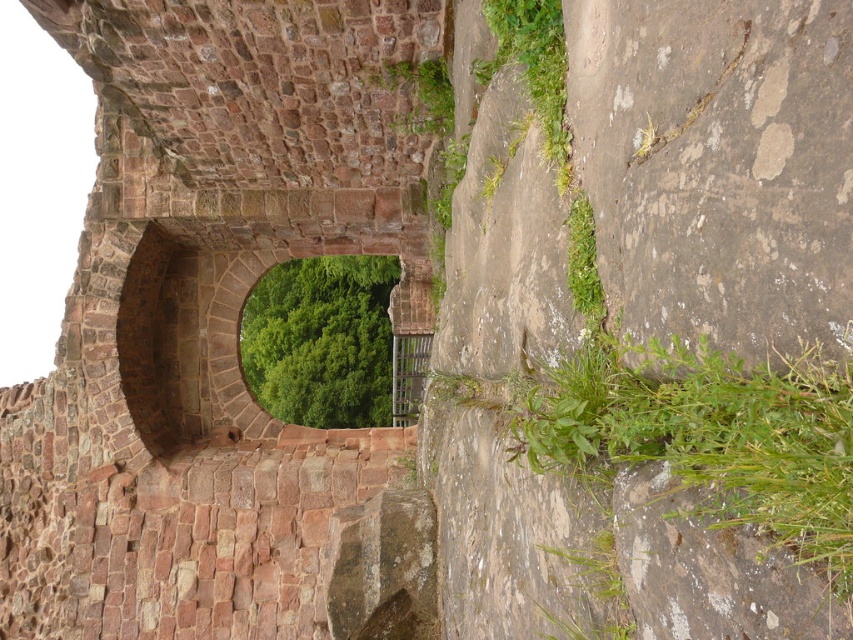
You are an explorer trying to navigate through the stone structure. You see the green leafy plant at lower right and the green leafy vegetation at center. Which one is smaller in size?

The green leafy plant at lower right is smaller in size compared to the green leafy vegetation at center.

You are standing in front of the stone archway and want to take a photo that includes both the green leafy plant at lower right and the green leafy plant at upper right. Which plant should you adjust your camera angle to focus on first to ensure both are in the frame?

You should focus on the green leafy plant at lower right first because it is in front of the green leafy plant at upper right, so adjusting your angle to include the lower one will naturally include the upper one as well.